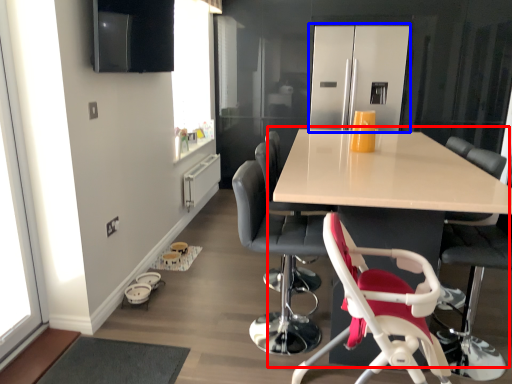
Question: Among these objects, which one is nearest to the camera, table (highlighted by a red box) or appliance (highlighted by a blue box)?

Choices:
 (A) table
 (B) appliance

Answer: (A)